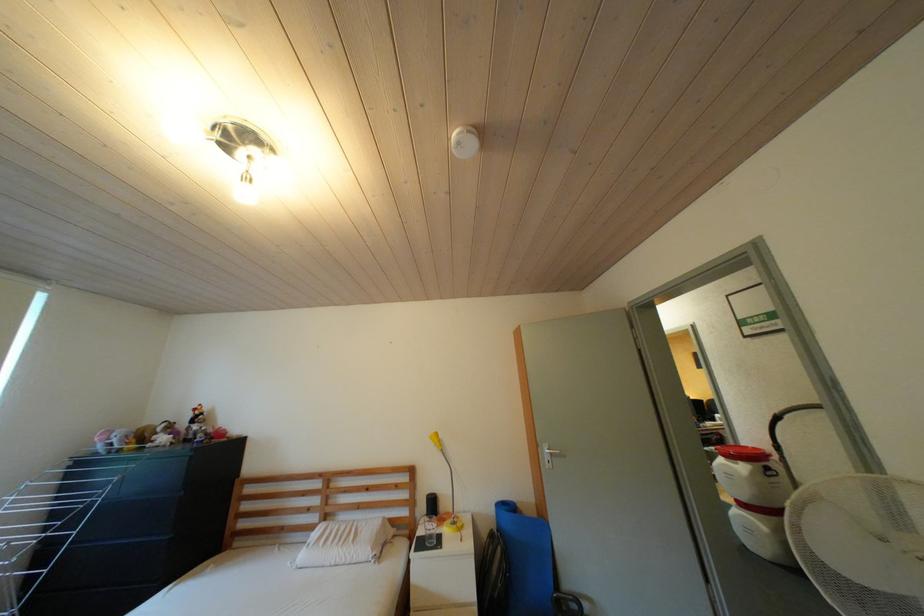
Describe the element at coordinates (138, 529) in the screenshot. I see `the black drawer handle` at that location.